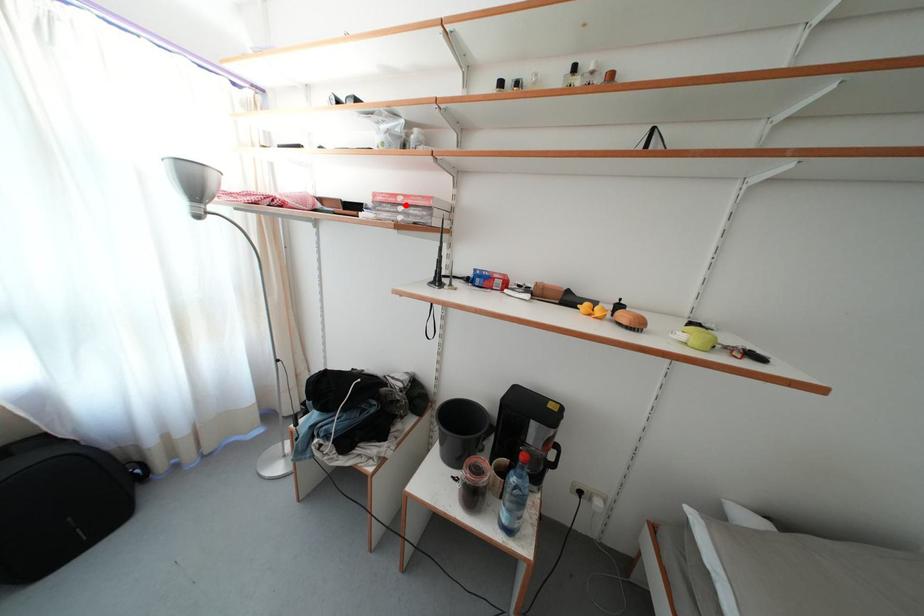
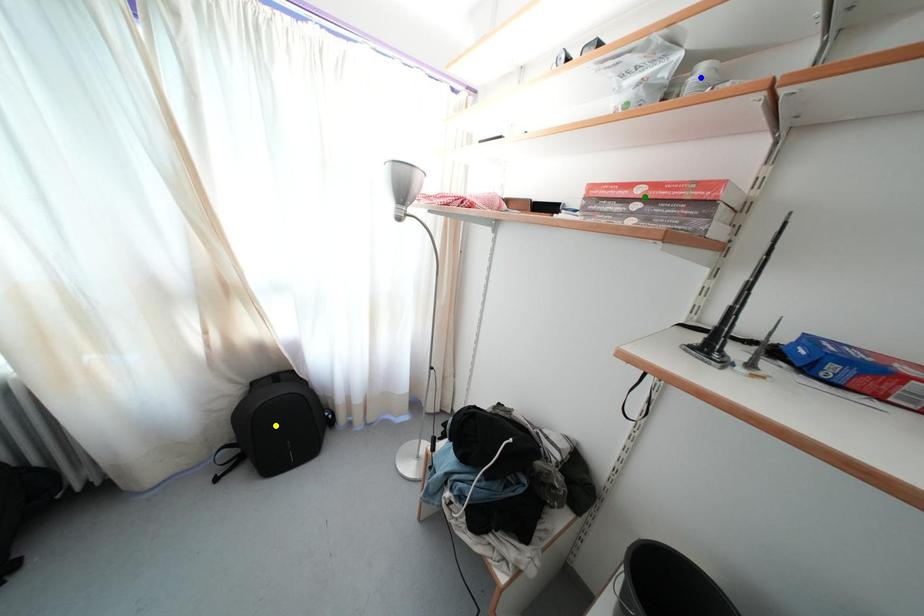
Question: I am providing you with two images of the same scene from different viewpoints. A red point is marked on the first image. You are given multiple points on the second image. Can you choose the point in image 2 that corresponds to the point in image 1?

Choices:
 (A) yellow point
 (B) blue point
 (C) green point

Answer: (C)